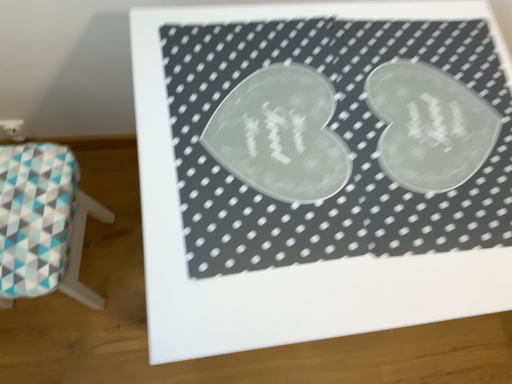
Question: Is point (494, 198) closer or farther from the camera than point (27, 162)?

Choices:
 (A) closer
 (B) farther

Answer: (A)

Question: Would you say transparent plastic bulletin board at center is to the left or to the right of teal and white fabric stool at lower left in the picture?

Choices:
 (A) left
 (B) right

Answer: (B)

Question: From the image's perspective, is transparent plastic bulletin board at center positioned above or below teal and white fabric stool at lower left?

Choices:
 (A) above
 (B) below

Answer: (A)

Question: In the image, is teal and white fabric stool at lower left positioned in front of or behind transparent plastic bulletin board at center?

Choices:
 (A) behind
 (B) front

Answer: (A)

Question: Is point (60, 241) positioned closer to the camera than point (163, 107)?

Choices:
 (A) closer
 (B) farther

Answer: (B)

Question: Is teal and white fabric stool at lower left spatially inside transparent plastic bulletin board at center, or outside of it?

Choices:
 (A) outside
 (B) inside

Answer: (A)

Question: From the image's perspective, relative to transparent plastic bulletin board at center, is teal and white fabric stool at lower left above or below?

Choices:
 (A) above
 (B) below

Answer: (B)